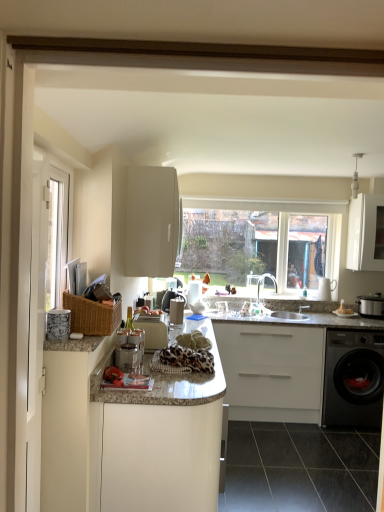
Question: Can you confirm if matte white bowl at right is thinner than metallic silver slow cooker at right, the 1th appliance viewed from the right?

Choices:
 (A) no
 (B) yes

Answer: (B)

Question: From the image's perspective, is matte white bowl at right under metallic silver slow cooker at right, marked as the 4th appliance in a front-to-back arrangement?

Choices:
 (A) no
 (B) yes

Answer: (B)

Question: Is the position of matte white bowl at right less distant than that of metallic silver slow cooker at right, positioned as the first appliance in back-to-front order?

Choices:
 (A) no
 (B) yes

Answer: (A)

Question: Is matte white bowl at right with metallic silver slow cooker at right, marked as the 4th appliance in a front-to-back arrangement?

Choices:
 (A) yes
 (B) no

Answer: (B)

Question: Is matte white bowl at right not within metallic silver slow cooker at right, the 1th appliance viewed from the right?

Choices:
 (A) no
 (B) yes

Answer: (B)

Question: Is matte white bowl at right positioned with its back to metallic silver slow cooker at right, marked as the 4th appliance in a front-to-back arrangement?

Choices:
 (A) yes
 (B) no

Answer: (B)

Question: Is the depth of porcelain textured mug at left, marked as the first appliance in a left-to-right arrangement, less than that of satin nickel faucet at center?

Choices:
 (A) no
 (B) yes

Answer: (B)

Question: From a real-world perspective, is porcelain textured mug at left, arranged as the 4th appliance when viewed from the back, under satin nickel faucet at center?

Choices:
 (A) no
 (B) yes

Answer: (A)

Question: Is satin nickel faucet at center at the back of porcelain textured mug at left, arranged as the 4th appliance when viewed from the back?

Choices:
 (A) no
 (B) yes

Answer: (A)

Question: From the image's perspective, is porcelain textured mug at left, arranged as the 4th appliance when viewed from the back, over satin nickel faucet at center?

Choices:
 (A) no
 (B) yes

Answer: (B)

Question: Is porcelain textured mug at left, arranged as the 4th appliance when viewed from the back, behind satin nickel faucet at center?

Choices:
 (A) yes
 (B) no

Answer: (B)

Question: From the image's perspective, does porcelain textured mug at left, which is the 1th appliance in front-to-back order, appear lower than satin nickel faucet at center?

Choices:
 (A) no
 (B) yes

Answer: (A)

Question: From the image's perspective, is white glossy countertop at center, arranged as the third cabinetry when viewed from the right, above white matte cabinet at center, placed as the 3th cabinetry when sorted from left to right?

Choices:
 (A) no
 (B) yes

Answer: (A)